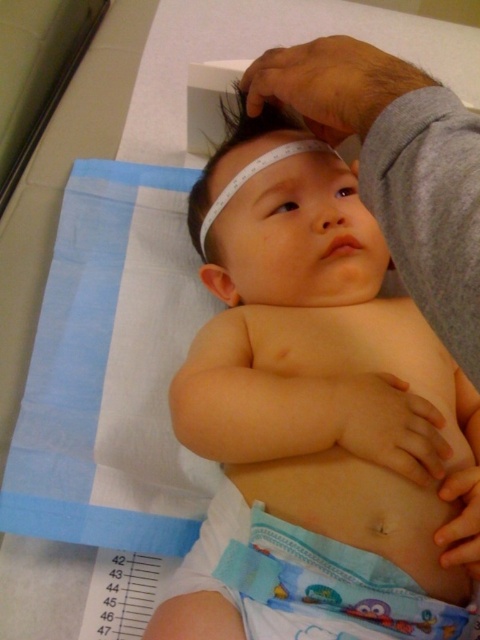
Describe the element at coordinates (317, 358) in the screenshot. I see `white smooth baby at center` at that location.

Which is behind, point (226, 227) or point (433, 632)?

Point (226, 227)

Is point (365, 301) in front of point (349, 563)?

No, it is not.

Locate an element on the screen. The width and height of the screenshot is (480, 640). white smooth baby at center is located at coordinates (317, 358).